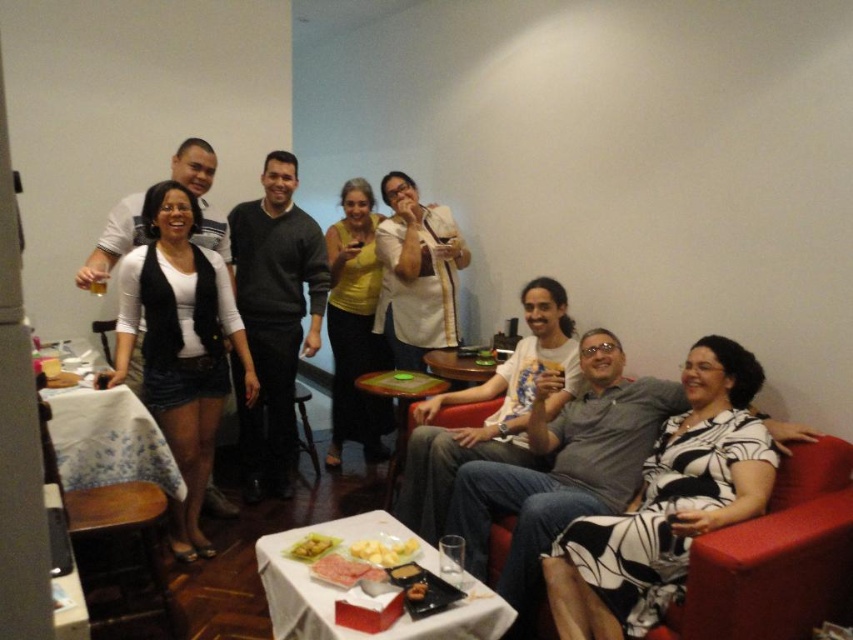
You are a guest at this gathering and want to place a 15 cm wide book on the table without moving any items. Considering the black and white dress at center and the smooth brown bread at center, which item should you avoid placing the book next to to ensure it fits?

The black and white dress at center might be wider than smooth brown bread at center, so you should avoid placing the book next to the black and white dress at center to ensure it fits.

You are a photographer setting up a shoot in the room. You need to place a large camera on the table where both the black and white dress at center and the dark gray sweater at center are located. Considering their sizes, which item should you move to make space?

Since the black and white dress at center is smaller than the dark gray sweater at center, you should move the dark gray sweater at center to create more space for the camera.